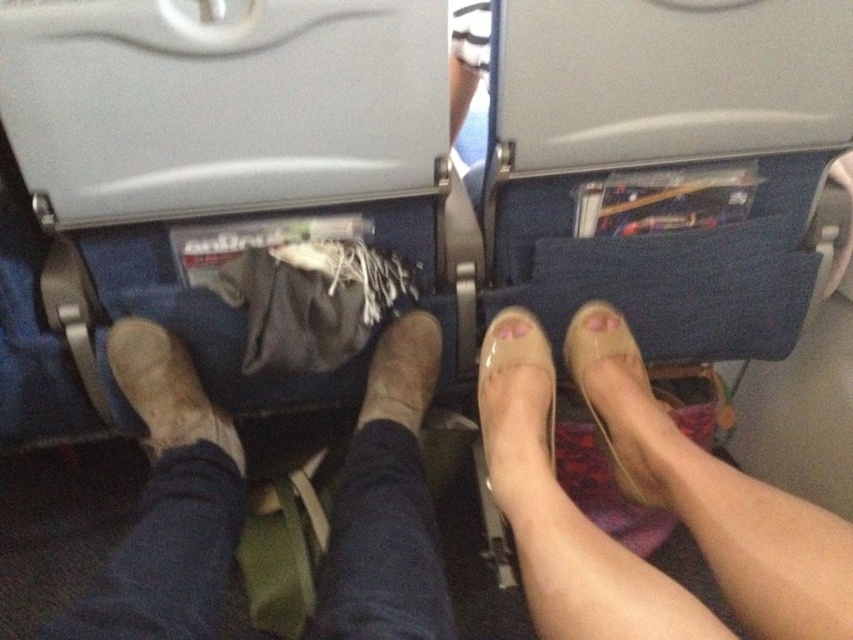
You are a flight attendant checking the tray tables for items. You notice the clear plastic shoes at center and the pink matte toe at center. Which item takes up more space on the tray table?

→ The clear plastic shoes at center takes up more space on the tray table because it is bigger than the pink matte toe at center.

You are a flight attendant checking seat tray tables for clearance. The airline requires that items placed on the tray must not exceed 30 cm in width. You observe the leather boot at center and the pink matte toe at center on the tray. Can both items fit within the width requirement?

The leather boot at center has a larger width than the pink matte toe at center. Since the airline requires items to be no wider than 30 cm, we need to check each item individually. However, the description only states the relative sizes between them, not their exact measurements. Without specific width data for either item, it is impossible to determine if they meet the 30 cm requirement.